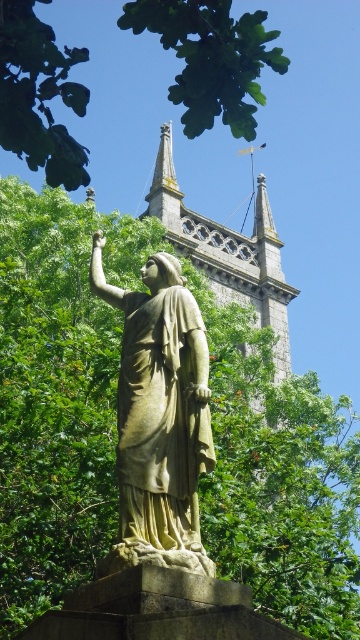
You are standing at the entrance of the park and want to take a photo of the stone statue at center. According to the image coordinates, where should you position yourself to capture the statue in the frame?

The stone statue at center is located at point coordinates 0.652 on the x axis and 0.442 on the y axis. To capture it in your photo, position yourself so the statue is centered at these coordinates.

You are a landscape architect planning to install a new pathway between the green leafy tree at center and the stone statue at center. The pathway requires a minimum of 15 meters of space. Can the pathway be installed between them?

The green leafy tree at center and the stone statue at center are 17.42 meters apart, which exceeds the minimum required 15 meters. Therefore, the pathway can be installed between them.